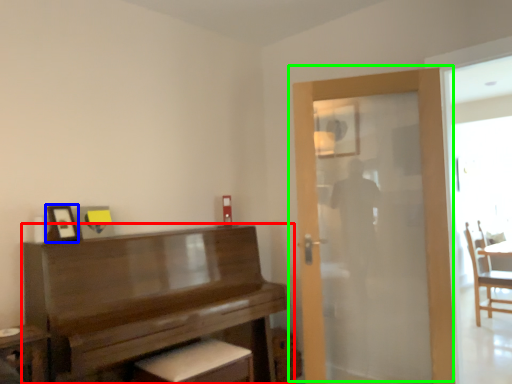
Question: Which object is positioned closest to piano (highlighted by a red box)? Select from picture frame (highlighted by a blue box) and door (highlighted by a green box).

Choices:
 (A) picture frame
 (B) door

Answer: (A)